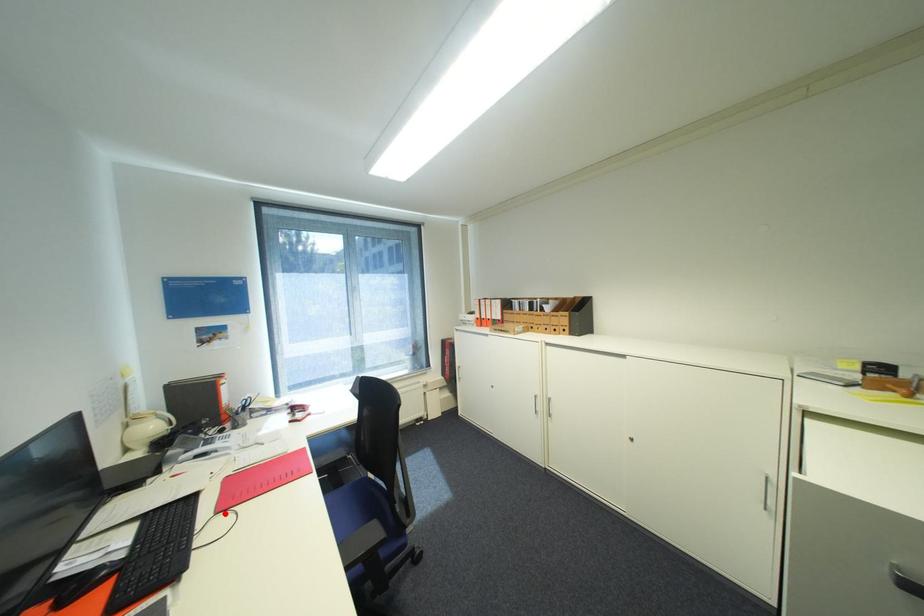
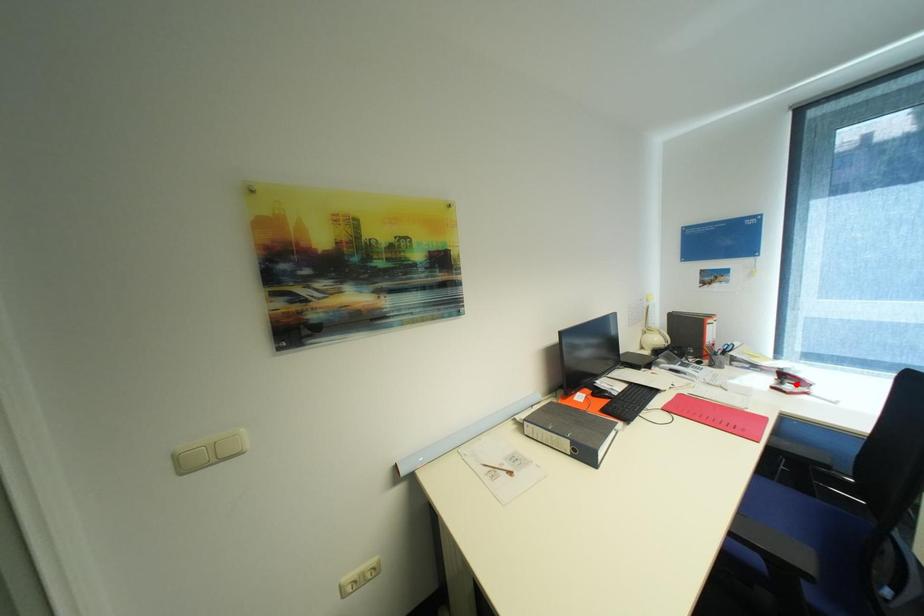
I am providing you with two images of the same scene from different viewpoints. A red point is marked on the first image and another point is marked on the second image. Do the highlighted points in image1 and image2 indicate the same real-world spot?

No